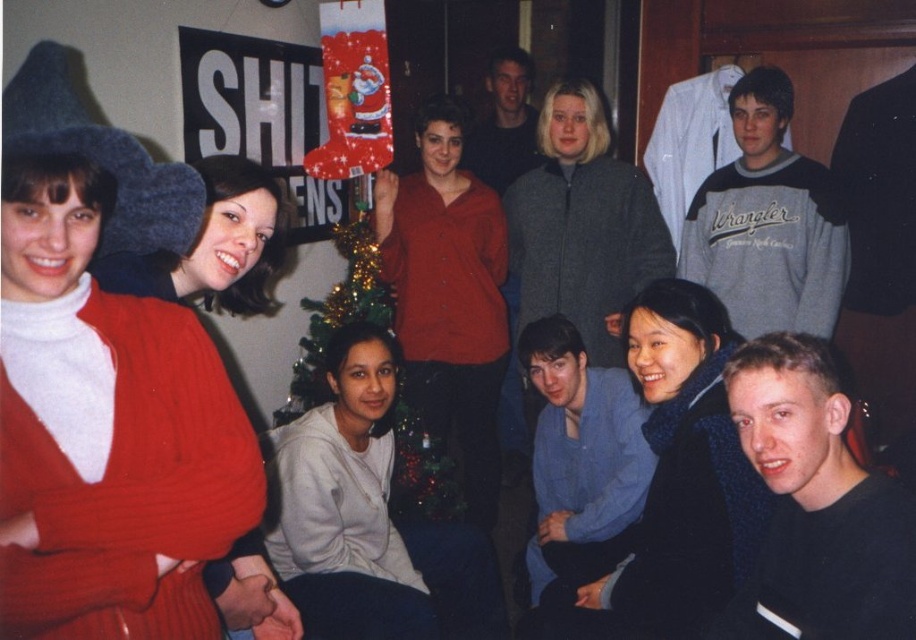
In the image, there is a point labeled at coordinates (x=815, y=506). Based on the scene description, which object does this point correspond to?

The point at coordinates (x=815, y=506) corresponds to the black matte shirt at lower right.